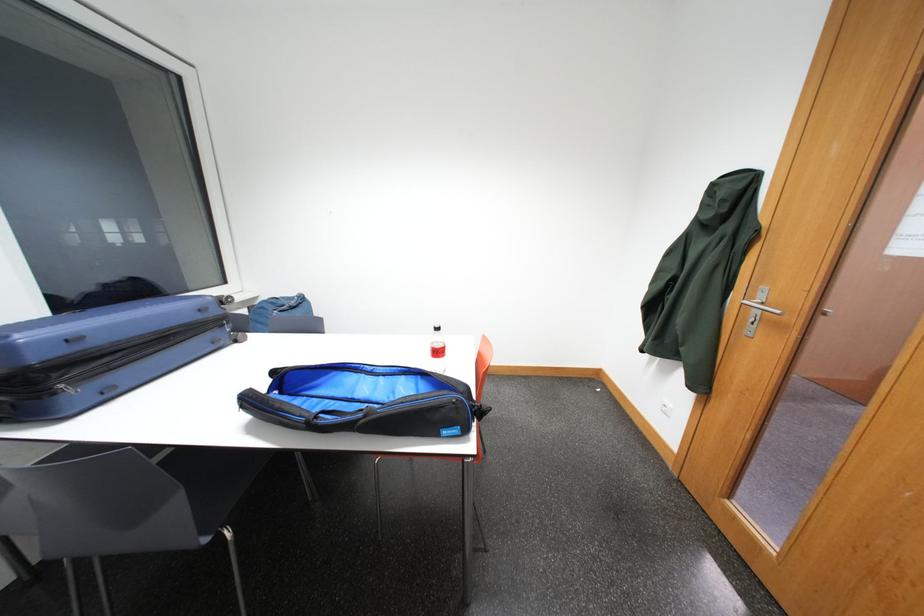
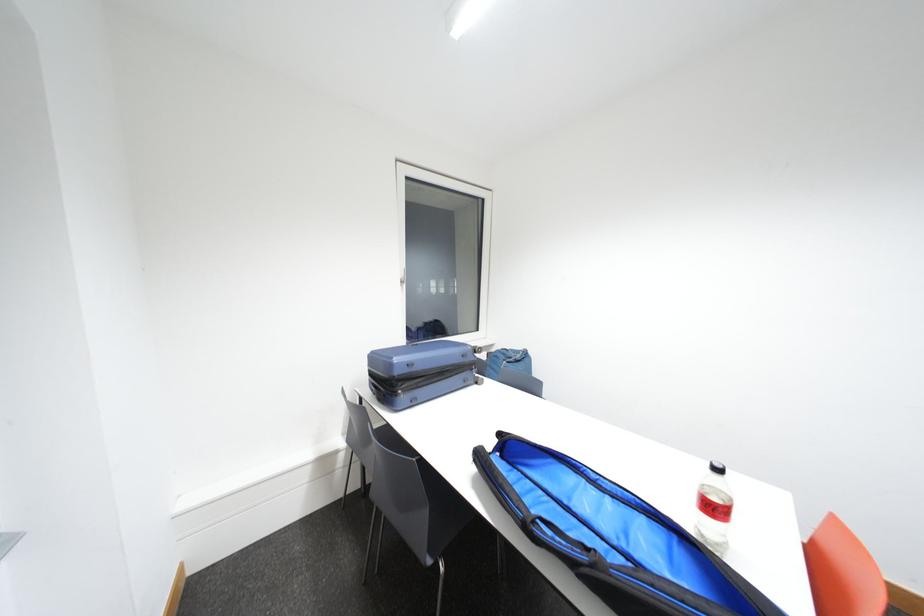
Question: The camera is either moving clockwise (left) or counter-clockwise (right) around the object. The first image is from the beginning of the video and the second image is from the end. Is the camera moving left or right when shooting the video?

Choices:
 (A) Left
 (B) Right

Answer: (B)